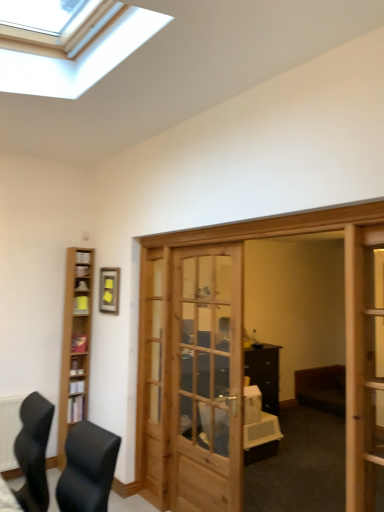
What do you see at coordinates (81, 305) in the screenshot?
I see `yellow paper at left, which ranks as the 2th shelf in bottom-to-top order` at bounding box center [81, 305].

The image size is (384, 512). Find the location of `wooden bookshelf at lower left, which is the first shelf in front-to-back order`. wooden bookshelf at lower left, which is the first shelf in front-to-back order is located at coordinates (75, 409).

Identify the location of light brown wood bookshelf at left. This screenshot has width=384, height=512. (75, 346).

Does point (109, 270) come farther from viewer compared to point (80, 311)?

No.

From the image's perspective, would you say yellow matte picture frame at upper left is positioned over yellow paper at left, which ranks as the 2th shelf in bottom-to-top order?

Yes, from the image's perspective, yellow matte picture frame at upper left is above yellow paper at left, which ranks as the 2th shelf in bottom-to-top order.

From a real-world perspective, is yellow matte picture frame at upper left below yellow paper at left, the 2th shelf positioned from the front?

No.

Looking at this image, is there a large distance between yellow matte picture frame at upper left and yellow paper at left, which ranks as the 2th shelf in bottom-to-top order?

They are positioned close to each other.

Considering the sizes of objects yellow paper at left, placed as the first shelf when sorted from top to bottom, and wooden bookshelf at lower left, which is the first shelf in front-to-back order, in the image provided, who is wider, yellow paper at left, placed as the first shelf when sorted from top to bottom, or wooden bookshelf at lower left, which is the first shelf in front-to-back order,?

Wider between the two is yellow paper at left, placed as the first shelf when sorted from top to bottom.

Looking at this image, from a real-world perspective, is yellow paper at left, placed as the first shelf when sorted from top to bottom, physically below wooden bookshelf at lower left, which is the first shelf in front-to-back order?

No.

Is yellow paper at left, which is counted as the 1th shelf, starting from the back, inside or outside of wooden bookshelf at lower left, the first shelf when ordered from bottom to top?

yellow paper at left, which is counted as the 1th shelf, starting from the back, is not enclosed by wooden bookshelf at lower left, the first shelf when ordered from bottom to top.

Is point (82, 296) closer or farther from the camera than point (68, 412)?

Point (82, 296).

From the image's perspective, between wooden screen door at right and wooden bookshelf at lower left, which ranks as the second shelf in back-to-front order, who is located below?

wooden bookshelf at lower left, which ranks as the second shelf in back-to-front order, appears lower in the image.

Are wooden screen door at right and wooden bookshelf at lower left, the first shelf when ordered from bottom to top, far apart?

Yes.

Considering the sizes of objects wooden screen door at right and wooden bookshelf at lower left, arranged as the 2th shelf when viewed from the top, in the image provided, who is wider, wooden screen door at right or wooden bookshelf at lower left, arranged as the 2th shelf when viewed from the top,?

wooden screen door at right is wider.

Can yellow matte picture frame at upper left be found inside wooden bookshelf at lower left, which is the first shelf in front-to-back order?

No, yellow matte picture frame at upper left is not inside wooden bookshelf at lower left, which is the first shelf in front-to-back order.

From a real-world perspective, is wooden bookshelf at lower left, the first shelf when ordered from bottom to top, below yellow matte picture frame at upper left?

Yes, from a real-world perspective, wooden bookshelf at lower left, the first shelf when ordered from bottom to top, is beneath yellow matte picture frame at upper left.

Could you tell me if wooden bookshelf at lower left, the first shelf when ordered from bottom to top, is facing yellow matte picture frame at upper left?

No, wooden bookshelf at lower left, the first shelf when ordered from bottom to top, is not facing towards yellow matte picture frame at upper left.

Is wooden bookshelf at lower left, arranged as the 2th shelf when viewed from the top, in front of or behind yellow matte picture frame at upper left in the image?

Visually, wooden bookshelf at lower left, arranged as the 2th shelf when viewed from the top, is located behind yellow matte picture frame at upper left.

Is light brown wood bookshelf at left completely or partially inside yellow matte picture frame at upper left?

No, light brown wood bookshelf at left is located outside of yellow matte picture frame at upper left.

Is yellow matte picture frame at upper left far from light brown wood bookshelf at left?

That's not correct — yellow matte picture frame at upper left is a little close to light brown wood bookshelf at left.

From a real-world perspective, does yellow matte picture frame at upper left stand above light brown wood bookshelf at left?

Yes, from a real-world perspective, yellow matte picture frame at upper left is on top of light brown wood bookshelf at left.

In the scene shown: Which of these two, yellow matte picture frame at upper left or light brown wood bookshelf at left, stands taller?

light brown wood bookshelf at left is taller.

Is wooden bookshelf at lower left, which ranks as the second shelf in back-to-front order, not close to light brown wood bookshelf at left?

No, wooden bookshelf at lower left, which ranks as the second shelf in back-to-front order, is in close proximity to light brown wood bookshelf at left.

Which of these two, wooden bookshelf at lower left, arranged as the 2th shelf when viewed from the top, or light brown wood bookshelf at left, stands shorter?

Standing shorter between the two is wooden bookshelf at lower left, arranged as the 2th shelf when viewed from the top.

Which is more to the right, wooden bookshelf at lower left, the first shelf when ordered from bottom to top, or light brown wood bookshelf at left?

From the viewer's perspective, wooden bookshelf at lower left, the first shelf when ordered from bottom to top, appears more on the right side.

In terms of size, does wooden bookshelf at lower left, the first shelf when ordered from bottom to top, appear bigger or smaller than light brown wood bookshelf at left?

wooden bookshelf at lower left, the first shelf when ordered from bottom to top, is smaller than light brown wood bookshelf at left.

Is light brown wood bookshelf at left situated inside wooden bookshelf at lower left, which ranks as the second shelf in back-to-front order, or outside?

light brown wood bookshelf at left is outside wooden bookshelf at lower left, which ranks as the second shelf in back-to-front order.

Locate an element on the screen. The image size is (384, 512). cabinetry above the wooden bookshelf at lower left, which ranks as the second shelf in back-to-front order (from the image's perspective) is located at coordinates (75, 346).

From a real-world perspective, is light brown wood bookshelf at left above or below wooden bookshelf at lower left, arranged as the 2th shelf when viewed from the top?

light brown wood bookshelf at left is above wooden bookshelf at lower left, arranged as the 2th shelf when viewed from the top.

Is light brown wood bookshelf at left facing towards wooden bookshelf at lower left, arranged as the 2th shelf when viewed from the top?

Yes, light brown wood bookshelf at left is aimed at wooden bookshelf at lower left, arranged as the 2th shelf when viewed from the top.

Locate an element on the screen. This screenshot has width=384, height=512. picture frame in front of the yellow paper at left, which is counted as the 1th shelf, starting from the back is located at coordinates (109, 290).

Identify the location of shelf on the left of the yellow paper at left, which is counted as the 1th shelf, starting from the back. This screenshot has height=512, width=384. (75, 409).

Estimate the real-world distances between objects in this image. Which object is further from wooden screen door at right, light brown wood bookshelf at left or yellow matte picture frame at upper left?

light brown wood bookshelf at left lies further to wooden screen door at right than the other object.

Based on the photo, which object lies nearer to the anchor point light brown wood bookshelf at left, black leather chair at lower left or yellow paper at left, which ranks as the 2th shelf in bottom-to-top order?

yellow paper at left, which ranks as the 2th shelf in bottom-to-top order.

Based on their spatial positions, is yellow matte picture frame at upper left or wooden bookshelf at lower left, arranged as the 2th shelf when viewed from the top, closer to yellow paper at left, the 2th shelf positioned from the front?

Among the two, yellow matte picture frame at upper left is located nearer to yellow paper at left, the 2th shelf positioned from the front.

Based on the photo, when comparing their distances from wooden bookshelf at lower left, which is the first shelf in front-to-back order, does black leather chair at lower left or yellow paper at left, which is counted as the 1th shelf, starting from the back, seem closer?

Among the two, black leather chair at lower left is located nearer to wooden bookshelf at lower left, which is the first shelf in front-to-back order.

Looking at this image, from the image, which object appears to be farther from black leather chair at lower left, light brown wood bookshelf at left or wooden bookshelf at lower left, which ranks as the second shelf in back-to-front order?

wooden bookshelf at lower left, which ranks as the second shelf in back-to-front order, is positioned further to the anchor black leather chair at lower left.

Looking at this image, from the image, which object appears to be farther from yellow matte picture frame at upper left, black leather chair at lower left or light brown wood bookshelf at left?

The object further to yellow matte picture frame at upper left is black leather chair at lower left.

When comparing their distances from black leather chair at lower left, does yellow matte picture frame at upper left or light brown wood bookshelf at left seem further?

yellow matte picture frame at upper left is further to black leather chair at lower left.

Looking at this image, when comparing their distances from wooden screen door at right, does light brown wood bookshelf at left or yellow paper at left, placed as the first shelf when sorted from top to bottom, seem further?

The object further to wooden screen door at right is yellow paper at left, placed as the first shelf when sorted from top to bottom.

Find the location of a particular element. picture frame between black leather chair at lower left and light brown wood bookshelf at left along the z-axis is located at coordinates (109, 290).

Where is `shelf between yellow matte picture frame at upper left and wooden bookshelf at lower left, the first shelf when ordered from bottom to top, vertically`? The height and width of the screenshot is (512, 384). shelf between yellow matte picture frame at upper left and wooden bookshelf at lower left, the first shelf when ordered from bottom to top, vertically is located at coordinates (81, 305).

I want to click on cabinetry between black leather chair at lower left and yellow paper at left, the 2th shelf positioned from the front, from front to back, so click(x=75, y=346).

This screenshot has height=512, width=384. I want to click on shelf between wooden bookshelf at lower left, which is the first shelf in front-to-back order, and wooden screen door at right from left to right, so coord(81,305).